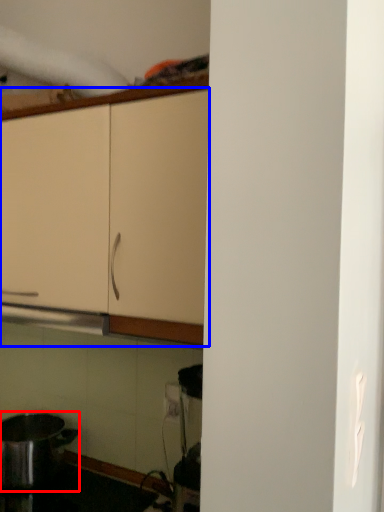
Question: Which object appears farthest to the camera in this image, kitchen appliance (highlighted by a red box) or cabinetry (highlighted by a blue box)?

Choices:
 (A) kitchen appliance
 (B) cabinetry

Answer: (A)